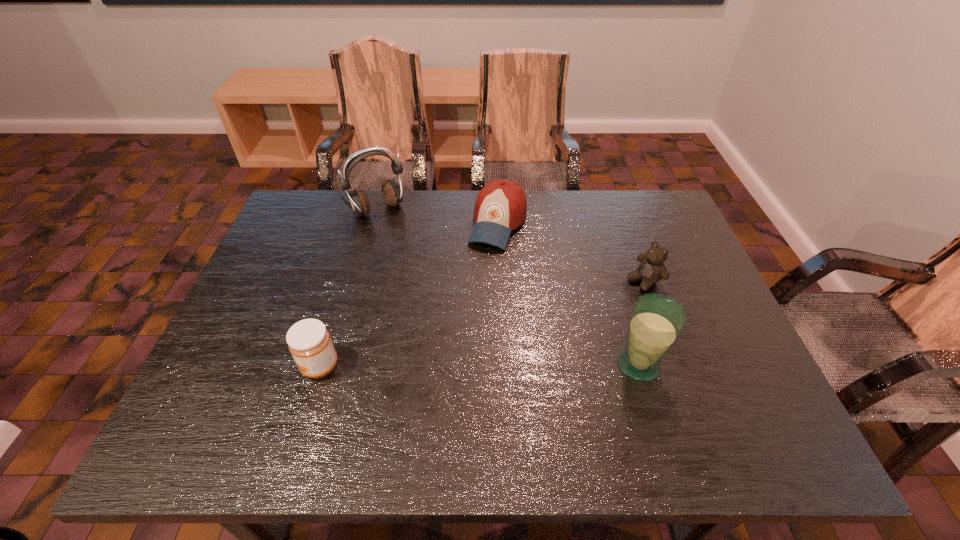
Find the location of `empty location between the teddy bear and the jam`. empty location between the teddy bear and the jam is located at coordinates (482, 323).

At what (x,y) coordinates should I click in order to perform the action: click on empty space that is in between the third nearest object and the jam. Please return your answer as a coordinate pair (x, y). Looking at the image, I should click on (482, 323).

Image resolution: width=960 pixels, height=540 pixels. Find the location of `vacant area between the teddy bear and the earphone`. vacant area between the teddy bear and the earphone is located at coordinates (511, 245).

You are a GUI agent. You are given a task and a screenshot of the screen. Output one action in this format:
    pyautogui.click(x=<x>, y=<y>)
    Task: Click on the vacant space in between the jam and the tallest object
    
    Given the screenshot: What is the action you would take?
    pyautogui.click(x=348, y=288)

Locate an element on the screen. The height and width of the screenshot is (540, 960). vacant area that lies between the tallest object and the teddy bear is located at coordinates (511, 245).

The width and height of the screenshot is (960, 540). In order to click on vacant space that's between the tallest object and the third farthest object in this screenshot , I will do `click(511, 245)`.

Image resolution: width=960 pixels, height=540 pixels. I want to click on free point between the earphone and the jam, so click(x=348, y=288).

Where is `vacant space in between the teddy bear and the third object from right to left`? vacant space in between the teddy bear and the third object from right to left is located at coordinates (571, 252).

What are the coordinates of `object that stands as the fourth closest to the third object from right to left` in the screenshot? It's located at (309, 342).

The height and width of the screenshot is (540, 960). What are the coordinates of `object that is the second closest to the fourth shortest object` in the screenshot? It's located at (501, 206).